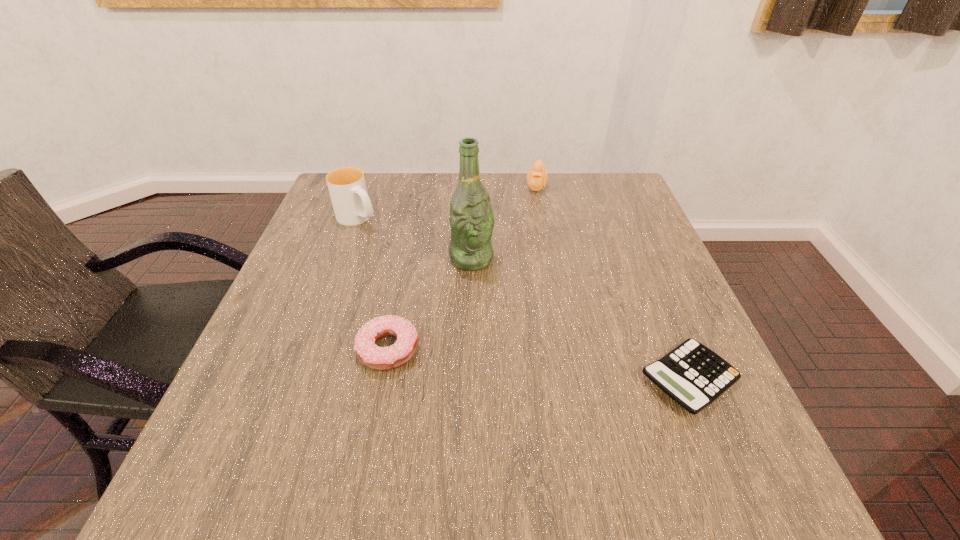
The image size is (960, 540). Identify the location of vacant space at the right edge of the desktop. (634, 294).

Locate an element on the screen. The width and height of the screenshot is (960, 540). vacant region at the far right corner of the desktop is located at coordinates (620, 182).

The width and height of the screenshot is (960, 540). Find the location of `unoccupied area between the second shortest object and the cup`. unoccupied area between the second shortest object and the cup is located at coordinates (372, 284).

Image resolution: width=960 pixels, height=540 pixels. In order to click on vacant space that is in between the third shortest object and the beer bottle in this screenshot , I will do `click(504, 222)`.

Locate an element on the screen. Image resolution: width=960 pixels, height=540 pixels. unoccupied position between the fourth object from left to right and the second farthest object is located at coordinates (446, 202).

I want to click on free space that is in between the second farthest object and the fourth object from right to left, so click(x=372, y=284).

The width and height of the screenshot is (960, 540). In order to click on free space between the beer bottle and the second object from right to left in this screenshot , I will do `click(504, 222)`.

The image size is (960, 540). I want to click on empty space between the third farthest object and the fourth tallest object, so click(x=430, y=303).

This screenshot has height=540, width=960. Identify the location of empty space between the rightmost object and the beer bottle. (580, 319).

You are a GUI agent. You are given a task and a screenshot of the screen. Output one action in this format:
    pyautogui.click(x=<x>, y=<y>)
    Task: Click on the unoccupied area between the shortest object and the tallest object
    The height and width of the screenshot is (540, 960).
    Given the screenshot: What is the action you would take?
    pyautogui.click(x=580, y=319)